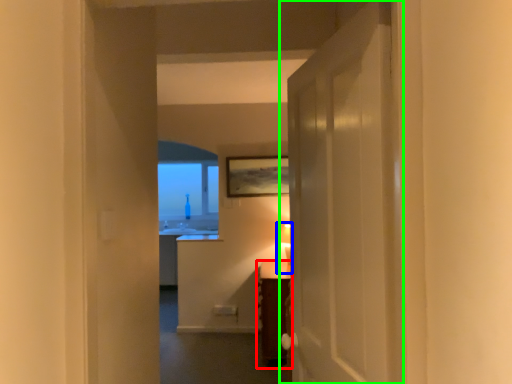
Question: Considering the real-world distances, which object is farthest from furniture (highlighted by a red box)? table lamp (highlighted by a blue box) or door (highlighted by a green box)?

Choices:
 (A) table lamp
 (B) door

Answer: (B)